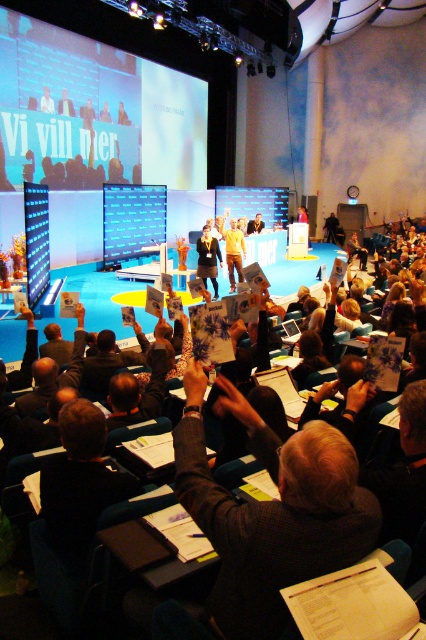
Question: Does white glossy projection screen at upper left have a larger size compared to matte blue projection screen at center?

Choices:
 (A) no
 (B) yes

Answer: (B)

Question: Observing the image, what is the correct spatial positioning of white glossy projection screen at upper left in reference to matte blue projection screen at center?

Choices:
 (A) right
 (B) left

Answer: (B)

Question: Does white glossy projection screen at upper left have a larger size compared to yellow fabric at center?

Choices:
 (A) yes
 (B) no

Answer: (A)

Question: Among these objects, which one is nearest to the camera?

Choices:
 (A) dark gray suit at center
 (B) dark blue shirt at center

Answer: (A)

Question: Which point is closer to the camera?

Choices:
 (A) (305, 460)
 (B) (213, 244)

Answer: (A)

Question: Estimate the real-world distances between objects in this image. Which object is farther from the dark gray suit at center?

Choices:
 (A) dark blue shirt at center
 (B) white glossy projection screen at upper left
 (C) matte blue projection screen at center

Answer: (B)